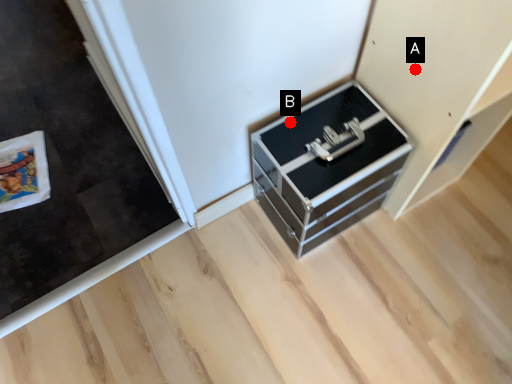
Question: Two points are circled on the image, labeled by A and B beside each circle. Among these points, which one is nearest to the camera?

Choices:
 (A) A is closer
 (B) B is closer

Answer: (A)